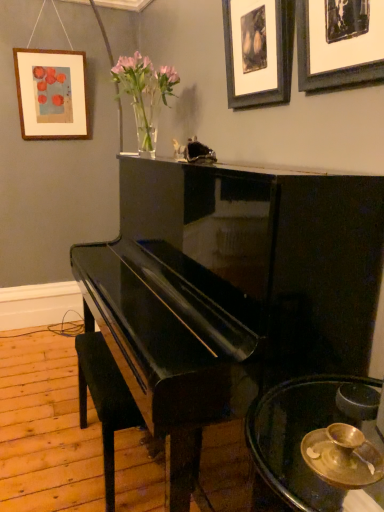
The width and height of the screenshot is (384, 512). I want to click on free space that is to the left of gold metallic bowl at lower right, so click(278, 461).